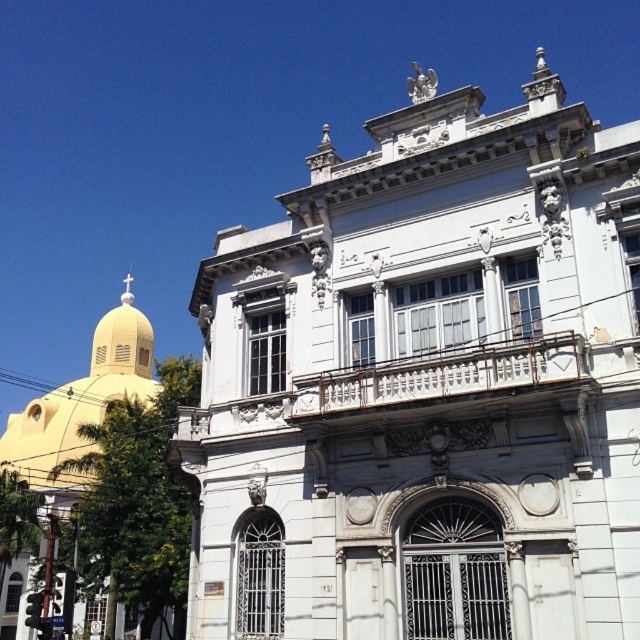
Who is higher up, matte yellow dome at upper left or matte yellow dome at left?

matte yellow dome at upper left is above.

Does matte yellow dome at upper left appear over matte yellow dome at left?

Yes, matte yellow dome at upper left is above matte yellow dome at left.

Identify the location of matte yellow dome at upper left. (426, 385).

Identify the location of matte yellow dome at upper left. point(426,385).